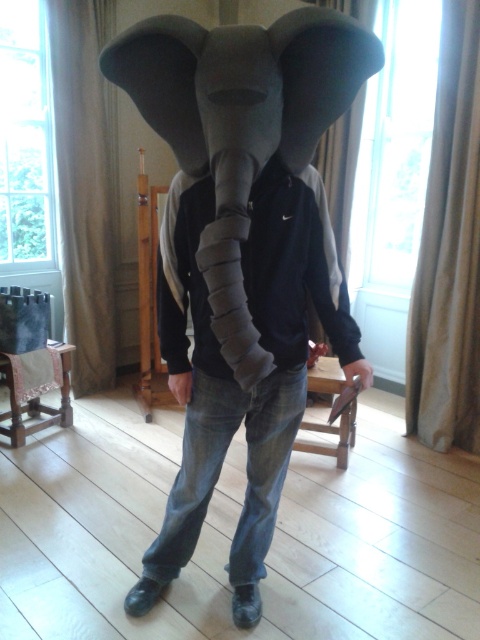
Question: Which point appears closest to the camera in this image?

Choices:
 (A) [x=352, y=80]
 (B) [x=307, y=273]

Answer: (A)

Question: Can you confirm if matte gray elephant head at center is wider than felt elephant head at center?

Choices:
 (A) no
 (B) yes

Answer: (B)

Question: Can you confirm if matte gray elephant head at center is positioned to the left of felt elephant head at center?

Choices:
 (A) no
 (B) yes

Answer: (A)

Question: Which point is closer to the camera?

Choices:
 (A) (275, 100)
 (B) (336, 298)

Answer: (A)

Question: Is matte gray elephant head at center closer to camera compared to felt elephant head at center?

Choices:
 (A) no
 (B) yes

Answer: (A)

Question: Which point appears closest to the camera in this image?

Choices:
 (A) (312, 22)
 (B) (227, 372)

Answer: (A)